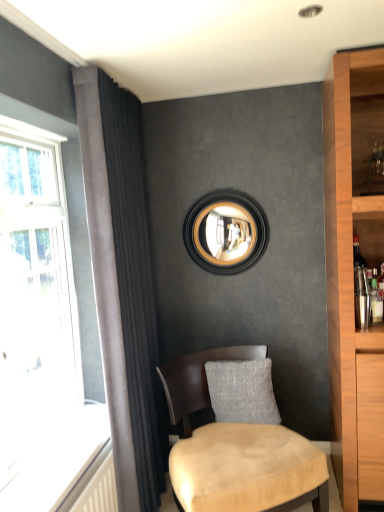
Measure the distance between point (192, 257) and camera.

Point (192, 257) and camera are 2.74 meters apart.

What is the approximate width of dark grey velvet curtain at left?

The width of dark grey velvet curtain at left is 7.70 inches.

What do you see at coordinates (242, 391) in the screenshot?
I see `gray textured pillow at center` at bounding box center [242, 391].

Where is `black wood picture frame at upper center`? Image resolution: width=384 pixels, height=512 pixels. black wood picture frame at upper center is located at coordinates (225, 232).

Is gray textured pillow at center completely or partially outside of suede beige chair at lower center?

That's incorrect, gray textured pillow at center is not completely outside suede beige chair at lower center.

Relative to suede beige chair at lower center, is gray textured pillow at center in front or behind?

gray textured pillow at center is behind suede beige chair at lower center.

Is point (235, 412) more distant than point (275, 474)?

Yes.

From a real-world perspective, is gray textured pillow at center on suede beige chair at lower center?

Yes, from a real-world perspective, gray textured pillow at center is above suede beige chair at lower center.

Based on the photo, is suede beige chair at lower center behind gray textured pillow at center?

No, it is not.

From the image's perspective, is suede beige chair at lower center on top of gray textured pillow at center?

No, from the image's perspective, suede beige chair at lower center is not on top of gray textured pillow at center.

The image size is (384, 512). Find the location of `pillow above the suede beige chair at lower center (from the image's perspective)`. pillow above the suede beige chair at lower center (from the image's perspective) is located at coordinates (242, 391).

From a real-world perspective, is black wood picture frame at upper center positioned over suede beige chair at lower center based on gravity?

Yes, from a real-world perspective, black wood picture frame at upper center is over suede beige chair at lower center

How many degrees apart are the facing directions of black wood picture frame at upper center and suede beige chair at lower center?

There is a 30.1-degree angle between the facing directions of black wood picture frame at upper center and suede beige chair at lower center.

Considering the positions of points (204, 260) and (202, 444), is point (204, 260) farther from camera compared to point (202, 444)?

Yes, it is behind point (202, 444).

Relative to suede beige chair at lower center, is black wood picture frame at upper center in front or behind?

Clearly, black wood picture frame at upper center is behind suede beige chair at lower center.

Which is more to the left, black wood picture frame at upper center or gray textured pillow at center?

Positioned to the left is black wood picture frame at upper center.

Can you confirm if black wood picture frame at upper center is smaller than gray textured pillow at center?

Indeed, black wood picture frame at upper center has a smaller size compared to gray textured pillow at center.

Which point is more forward, (208, 217) or (218, 419)?

The point (218, 419) is in front.

Consider the image. Is the position of gray textured pillow at center less distant than that of dark grey velvet curtain at left?

No.

From a real-world perspective, is gray textured pillow at center under dark grey velvet curtain at left?

Yes, from a real-world perspective, gray textured pillow at center is below dark grey velvet curtain at left.

Which is behind, point (217, 405) or point (143, 248)?

The point (143, 248) is behind.

Would you consider gray textured pillow at center to be distant from dark grey velvet curtain at left?

No, gray textured pillow at center is not far from dark grey velvet curtain at left.

Is suede beige chair at lower center not inside dark grey velvet curtain at left?

Yes, suede beige chair at lower center is not within dark grey velvet curtain at left.

I want to click on curtain lying on the left of suede beige chair at lower center, so click(x=123, y=284).

From the image's perspective, is suede beige chair at lower center over dark grey velvet curtain at left?

No, from the image's perspective, suede beige chair at lower center is not above dark grey velvet curtain at left.

Is point (207, 360) positioned behind point (133, 106)?

No, it is in front of (133, 106).

The width and height of the screenshot is (384, 512). Find the location of `pillow below the black wood picture frame at upper center (from a real-world perspective)`. pillow below the black wood picture frame at upper center (from a real-world perspective) is located at coordinates (242, 391).

Is gray textured pillow at center aimed at black wood picture frame at upper center?

No, gray textured pillow at center is not turned towards black wood picture frame at upper center.

From their relative heights in the image, would you say gray textured pillow at center is taller or shorter than black wood picture frame at upper center?

gray textured pillow at center is shorter than black wood picture frame at upper center.

Find the location of a particular element. The height and width of the screenshot is (512, 384). chair located on the left of gray textured pillow at center is located at coordinates (238, 447).

The image size is (384, 512). What are the coordinates of `pillow that is on the right side of suede beige chair at lower center` in the screenshot? It's located at (242, 391).

When comparing their distances from suede beige chair at lower center, does dark grey velvet curtain at left or black wood picture frame at upper center seem closer?

Among the two, dark grey velvet curtain at left is located nearer to suede beige chair at lower center.

From the image, which object appears to be nearer to dark grey velvet curtain at left, black wood picture frame at upper center or suede beige chair at lower center?

suede beige chair at lower center is positioned closer to the anchor dark grey velvet curtain at left.

From the image, which object appears to be farther from gray textured pillow at center, black wood picture frame at upper center or suede beige chair at lower center?

black wood picture frame at upper center is positioned further to the anchor gray textured pillow at center.

From the image, which object appears to be farther from suede beige chair at lower center, dark grey velvet curtain at left or gray textured pillow at center?

Among the two, dark grey velvet curtain at left is located further to suede beige chair at lower center.

Estimate the real-world distances between objects in this image. Which object is closer to suede beige chair at lower center, black wood picture frame at upper center or gray textured pillow at center?

The object closer to suede beige chair at lower center is gray textured pillow at center.

When comparing their distances from black wood picture frame at upper center, does dark grey velvet curtain at left or suede beige chair at lower center seem closer?

dark grey velvet curtain at left.

Looking at the image, which one is located further to black wood picture frame at upper center, suede beige chair at lower center or dark grey velvet curtain at left?

suede beige chair at lower center is positioned further to the anchor black wood picture frame at upper center.

When comparing their distances from black wood picture frame at upper center, does dark grey velvet curtain at left or gray textured pillow at center seem further?

gray textured pillow at center lies further to black wood picture frame at upper center than the other object.

The height and width of the screenshot is (512, 384). Identify the location of curtain between black wood picture frame at upper center and suede beige chair at lower center from top to bottom. (123, 284).

The width and height of the screenshot is (384, 512). I want to click on pillow that lies between dark grey velvet curtain at left and suede beige chair at lower center from top to bottom, so click(x=242, y=391).

Identify the location of curtain between black wood picture frame at upper center and gray textured pillow at center vertically. (123, 284).

You are a GUI agent. You are given a task and a screenshot of the screen. Output one action in this format:
    pyautogui.click(x=<x>, y=<y>)
    Task: Click on the pillow between black wood picture frame at upper center and suede beige chair at lower center vertically
    The height and width of the screenshot is (512, 384).
    Given the screenshot: What is the action you would take?
    pyautogui.click(x=242, y=391)